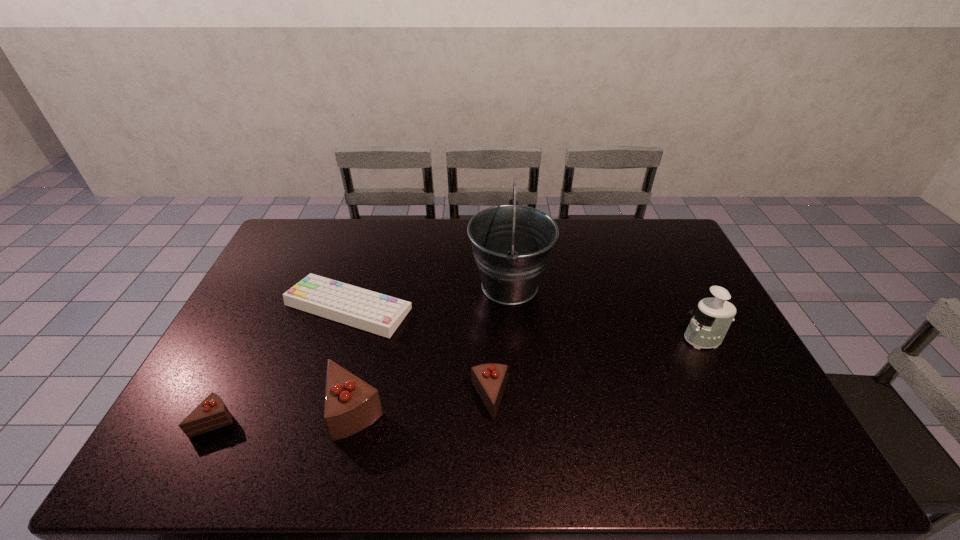
This screenshot has width=960, height=540. In order to click on vacant region located on the right of the leftmost chocolate cake in this screenshot , I will do `click(302, 421)`.

You are a GUI agent. You are given a task and a screenshot of the screen. Output one action in this format:
    pyautogui.click(x=<x>, y=<y>)
    Task: Click on the vacant space situated on the back of the third tallest object
    This screenshot has width=960, height=540.
    Given the screenshot: What is the action you would take?
    pyautogui.click(x=376, y=325)

Image resolution: width=960 pixels, height=540 pixels. Find the location of `free location located 0.260m on the left of the fourth tallest object`. free location located 0.260m on the left of the fourth tallest object is located at coordinates (372, 400).

Where is `blank area located 0.060m on the right of the tallest object`? This screenshot has height=540, width=960. blank area located 0.060m on the right of the tallest object is located at coordinates (569, 286).

I want to click on vacant region located 0.200m on the left of the second tallest object, so click(x=614, y=340).

The width and height of the screenshot is (960, 540). I want to click on blank space located on the back of the shortest object, so click(368, 247).

Identify the location of chocolate cake that is positioned at the left edge. (211, 414).

You are a GUI agent. You are given a task and a screenshot of the screen. Output one action in this format:
    pyautogui.click(x=<x>, y=<y>)
    Task: Click on the computer keyboard at the left edge
    The height and width of the screenshot is (540, 960).
    Given the screenshot: What is the action you would take?
    click(x=380, y=314)

Where is `object situated at the right edge`? This screenshot has height=540, width=960. object situated at the right edge is located at coordinates (710, 322).

Where is `object located in the near left corner section of the desktop`? This screenshot has height=540, width=960. object located in the near left corner section of the desktop is located at coordinates (211, 414).